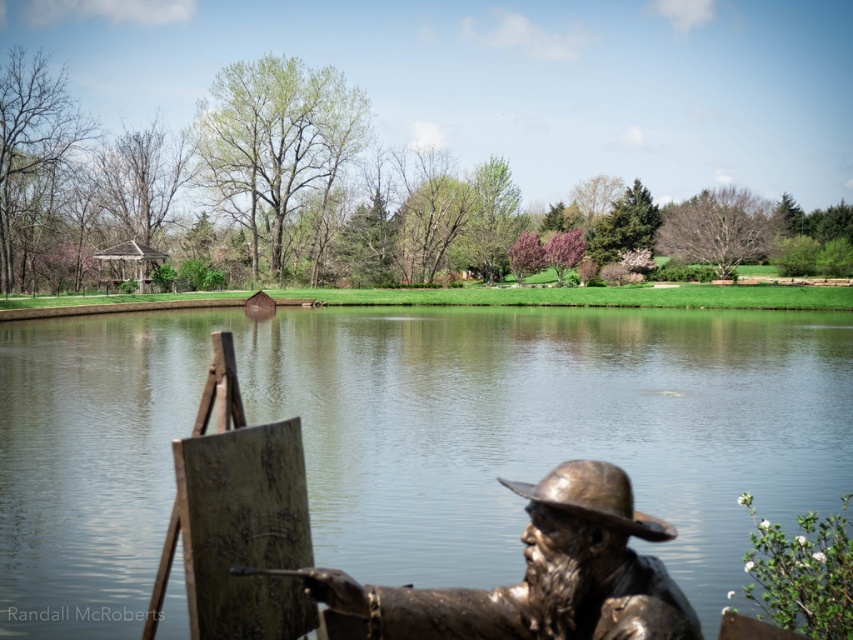
Question: Can you confirm if clear water at center is positioned to the right of bronze statue at lower right?

Choices:
 (A) no
 (B) yes

Answer: (B)

Question: Is clear water at center positioned before bronze statue at lower right?

Choices:
 (A) no
 (B) yes

Answer: (A)

Question: From the image, what is the correct spatial relationship of clear water at center in relation to bronze statue at lower right?

Choices:
 (A) right
 (B) left

Answer: (A)

Question: Which point is closer to the camera taking this photo?

Choices:
 (A) (612, 472)
 (B) (695, 547)

Answer: (A)

Question: Which of the following is the closest to the observer?

Choices:
 (A) (611, 484)
 (B) (154, 397)

Answer: (A)